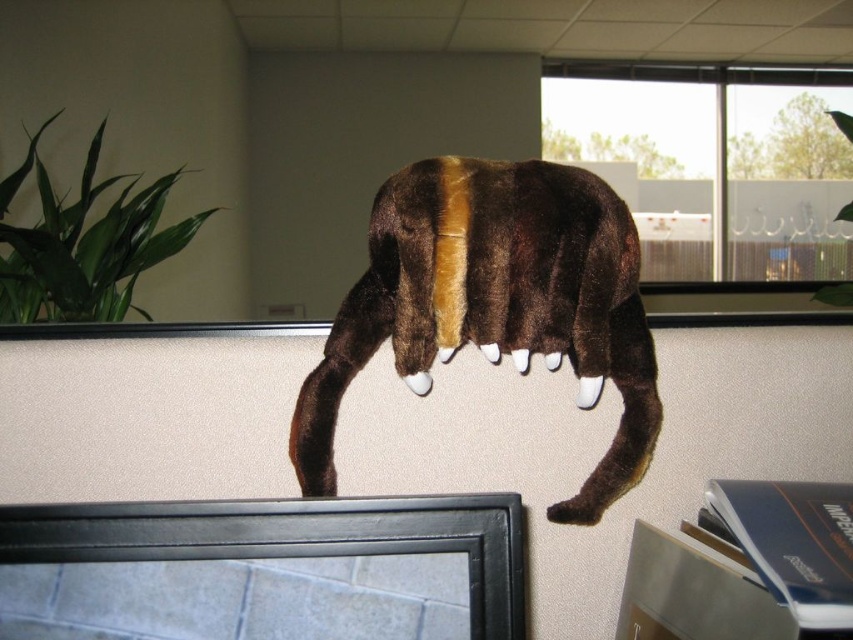
You are an office worker who wants to place a new photo frame on the cubicle wall where the brown plush toy is located. The photo frame must be placed exactly at the point marked by coordinates point (495, 304). However, you notice that there is already an object at that location. What is the object currently occupying that spot?

The point marked by coordinates point (495, 304) is currently occupied by the brown plush toy at center.

You are organizing a small shelf in your office and need to place both the brown plush toy at center and the brown plush tail at center. Since the shelf has limited space, which object should you place first to ensure both fit?

The brown plush tail at center is smaller in size than the brown plush toy at center, so you should place the larger brown plush toy at center first to ensure both fit on the shelf.